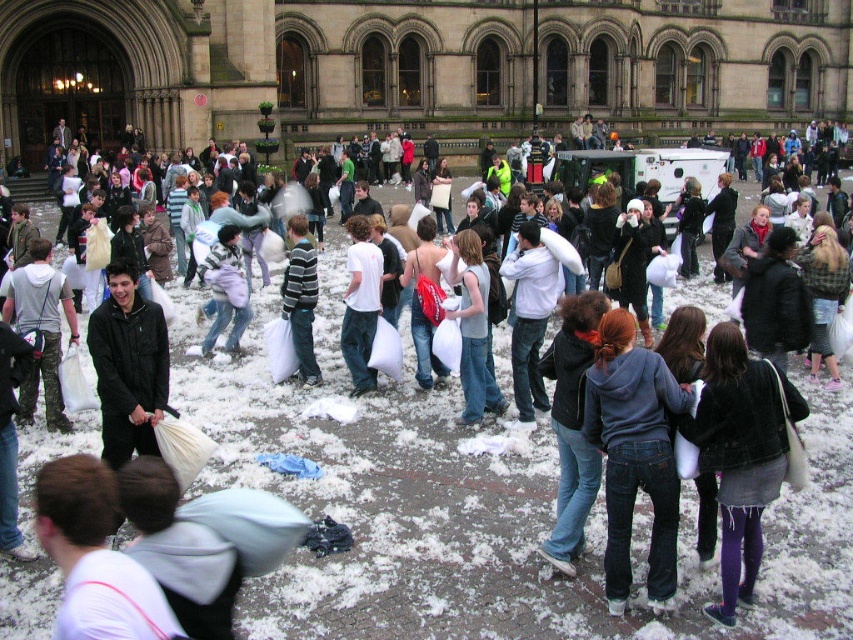
Question: Is denim jeans at center to the left of denim jacket at lower right from the viewer's perspective?

Choices:
 (A) no
 (B) yes

Answer: (B)

Question: Which is nearer to the denim jeans at center?

Choices:
 (A) striped sweater at center
 (B) denim jacket at lower right

Answer: (B)

Question: Based on their relative distances, which object is nearer to the striped sweater at center?

Choices:
 (A) denim jeans at center
 (B) denim jacket at lower right

Answer: (A)

Question: Does denim jeans at center appear on the right side of striped sweater at center?

Choices:
 (A) yes
 (B) no

Answer: (A)

Question: Considering the real-world distances, which object is closest to the striped sweater at center?

Choices:
 (A) denim jeans at center
 (B) denim jacket at lower right

Answer: (A)

Question: Does denim jacket at lower right have a greater width compared to striped sweater at center?

Choices:
 (A) yes
 (B) no

Answer: (B)